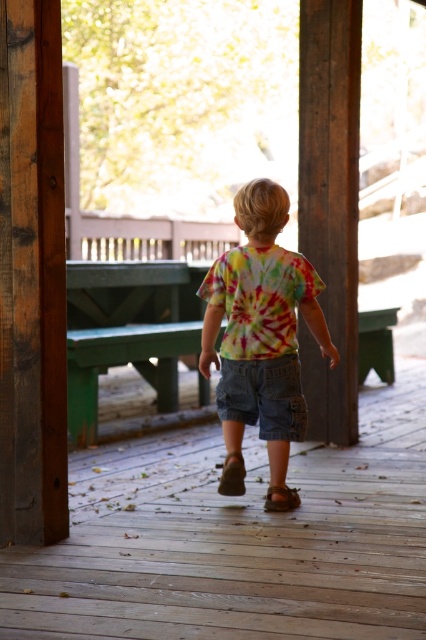
Question: Can you confirm if denim shorts at center is positioned to the left of brown suede sandal at center?

Choices:
 (A) no
 (B) yes

Answer: (B)

Question: Can you confirm if denim shorts at center is positioned above brown suede sandal at center?

Choices:
 (A) yes
 (B) no

Answer: (A)

Question: Which object appears closest to the camera in this image?

Choices:
 (A) tie-dye fabric shirt at center
 (B) wooden post at center
 (C) green wood picnic table at center
 (D) denim shorts at center

Answer: (A)

Question: Is brown wood pillar at left behind wooden post at center?

Choices:
 (A) no
 (B) yes

Answer: (A)

Question: Which point appears closest to the camera in this image?

Choices:
 (A) (267, 508)
 (B) (69, 269)
 (C) (333, 348)
 (D) (267, 358)

Answer: (D)

Question: Which point is closer to the camera?

Choices:
 (A) wooden post at center
 (B) brown suede sandal at center

Answer: (B)